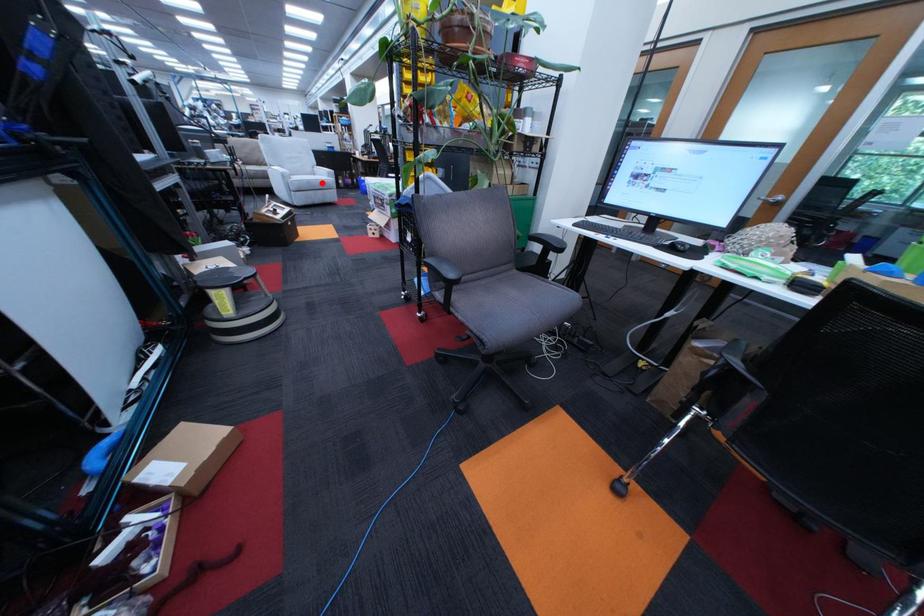
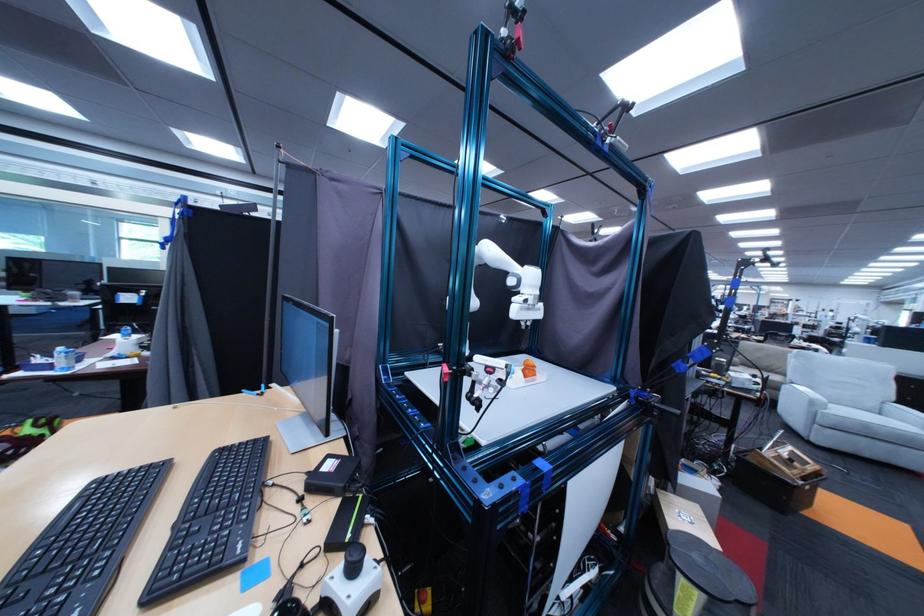
Where in the second image is the point corresponding to the highlighted location from the first image?

(879, 426)